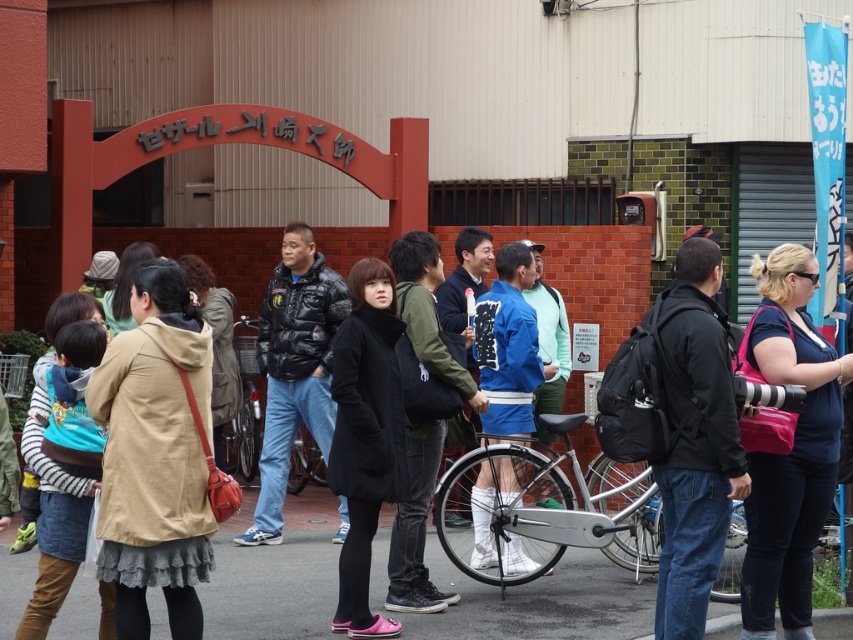
Question: Which point appears farthest from the camera in this image?

Choices:
 (A) (268, 291)
 (B) (253, 333)
 (C) (773, 362)

Answer: (B)

Question: Which point is closer to the camera taking this photo?

Choices:
 (A) (251, 461)
 (B) (329, 422)

Answer: (B)

Question: Does black matte coat at center come behind black puffy jacket at center?

Choices:
 (A) yes
 (B) no

Answer: (B)

Question: Can you confirm if dark blue fabric shirt at center is positioned to the right of blue fabric kimono at center?

Choices:
 (A) no
 (B) yes

Answer: (B)

Question: In this image, where is black matte coat at center located relative to blue fabric kimono at center?

Choices:
 (A) below
 (B) above

Answer: (A)

Question: Which object is farther from the camera taking this photo?

Choices:
 (A) silver metallic bicycle at center
 (B) blue fabric kimono at center
 (C) black matte coat at center

Answer: (B)